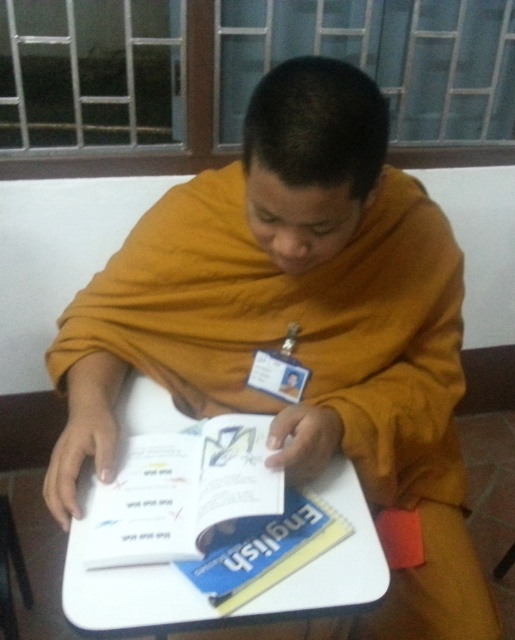
Question: Is blue hardcover book at center positioned in front of blue paper english book at center?

Choices:
 (A) no
 (B) yes

Answer: (B)

Question: Among these points, which one is farthest from the camera?

Choices:
 (A) (146, 500)
 (B) (296, 545)
 (C) (372, 568)

Answer: (A)

Question: Which point is closer to the camera?

Choices:
 (A) (94, 608)
 (B) (302, 502)
 (C) (186, 480)

Answer: (A)

Question: Can you confirm if white plastic table at center is positioned below white paper book at center?

Choices:
 (A) no
 (B) yes

Answer: (A)

Question: Which point is farther from the camera taking this photo?

Choices:
 (A) (148, 445)
 (B) (372, 561)

Answer: (A)

Question: Is white paper book at center wider than blue hardcover book at center?

Choices:
 (A) yes
 (B) no

Answer: (A)